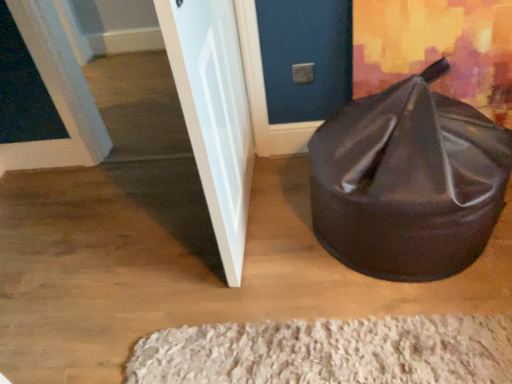
I want to click on free space to the back side of white shaggy rug at lower center, so click(267, 260).